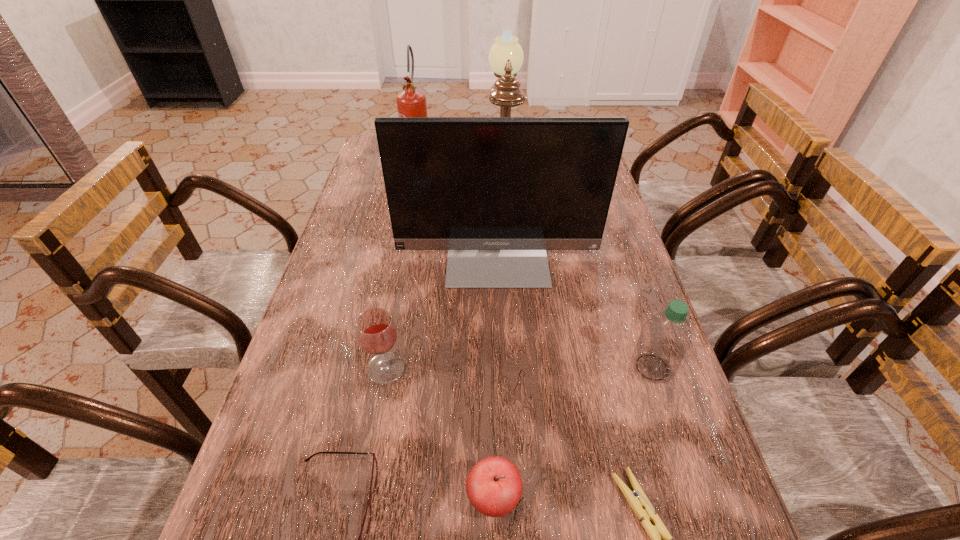
In order to click on vacant space situated 0.220m on the front of the water bottle in this screenshot , I will do `click(696, 501)`.

Identify the location of vacant space located 0.170m on the back of the fifth tallest object. This screenshot has height=540, width=960. (399, 296).

The width and height of the screenshot is (960, 540). I want to click on free point located 0.180m on the right of the apple, so click(x=627, y=498).

The image size is (960, 540). I want to click on oil lamp that is at the far edge, so click(506, 56).

This screenshot has width=960, height=540. In order to click on fire extinguisher located at the far edge in this screenshot , I will do `click(411, 102)`.

Locate an element on the screen. The height and width of the screenshot is (540, 960). object located in the left edge section of the desktop is located at coordinates (411, 102).

What are the coordinates of `computer monitor that is at the right edge` in the screenshot? It's located at (496, 192).

Find the location of `water bottle located at the right edge`. water bottle located at the right edge is located at coordinates (665, 338).

The width and height of the screenshot is (960, 540). What are the coordinates of `object that is at the far left corner` in the screenshot? It's located at (411, 102).

In the image, there is a desktop. Where is `vacant space at the left edge`? Image resolution: width=960 pixels, height=540 pixels. vacant space at the left edge is located at coordinates (333, 273).